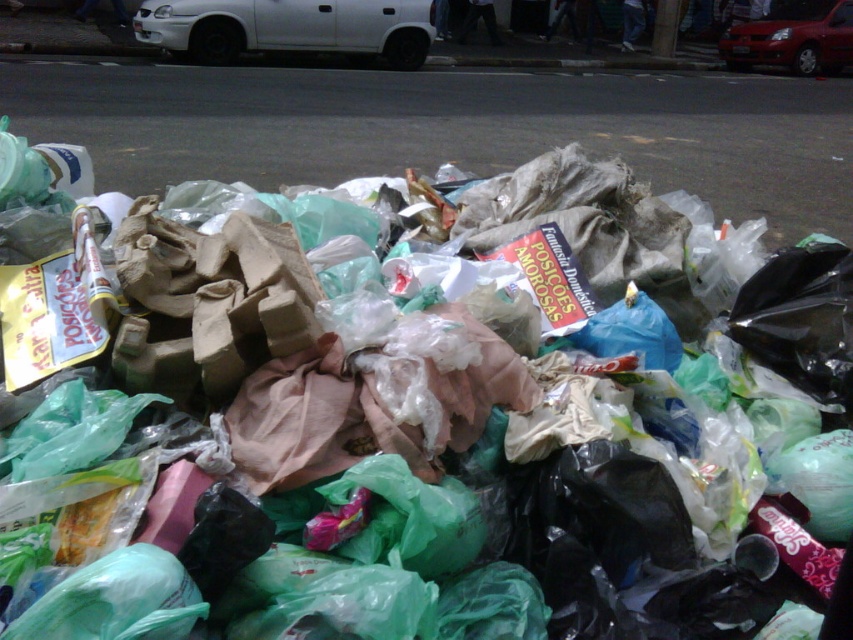
You are standing in front of the garbage pile and want to pick up the item at point (260, 44) and the item at point (822, 6). Which item will you reach first?

You will reach the item at point (260, 44) first because it is closer to you than the item at point (822, 6).

You are a delivery person trying to navigate through the street where the garbage pile is located. You need to drive your van between the white matte car at upper left and the shiny red car at upper right. Based on their positions, can you safely pass through the gap between them?

The white matte car at upper left is below the shiny red car at upper right, so there is vertical space between them. However, since cars are typically parked side by side along a street, the gap between them might be narrow. Without knowing the exact width of your van or the distance between the cars, it is difficult to determine if you can safely pass through. Consider checking the space or choosing an alternative route for safety.

You are a delivery driver who needs to park your vehicle near the garbage pile. There is a point marked at coordinate (288, 28) which indicates the location of a white matte car at upper left. Can you safely park your vehicle in the same spot as the white matte car at upper left without blocking the pedestrian path?

The point at (288, 28) indicates the location of the white matte car at upper left. Since the car is already parked there, you cannot park in the same spot. However, you should look for an alternative parking area that does not obstruct the pedestrian path.